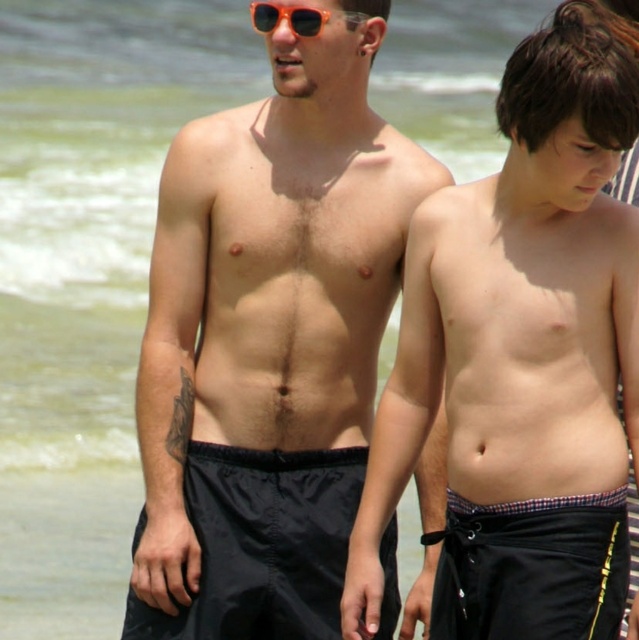
You are a photographer trying to capture the two subjects in the scene. Given that the matte black shorts at center and the plaid fabric shorts at lower center are part of their outfits, which pair of shorts would appear bigger in the photo?

The matte black shorts at center would appear bigger in the photo since they have a larger size compared to the plaid fabric shorts at lower center.

You are a photographer trying to capture the perfect shot of the matte black shorts at center. Based on their position in the image, what coordinates should you aim your camera at to ensure the shorts are centered in the frame?

The 2D location of the matte black shorts at center is at point (268,340), so you should aim your camera at those coordinates to center them in the frame.

You are a photographer trying to capture a candid shot of the two males at the beach. You notice the black nylon shorts at center and the orange plastic sunglasses at upper center. Which object should you focus on first if you want to capture the lower part of the scene?

You should focus on the black nylon shorts at center first because it is located below the orange plastic sunglasses at upper center, making it part of the lower section of the scene.